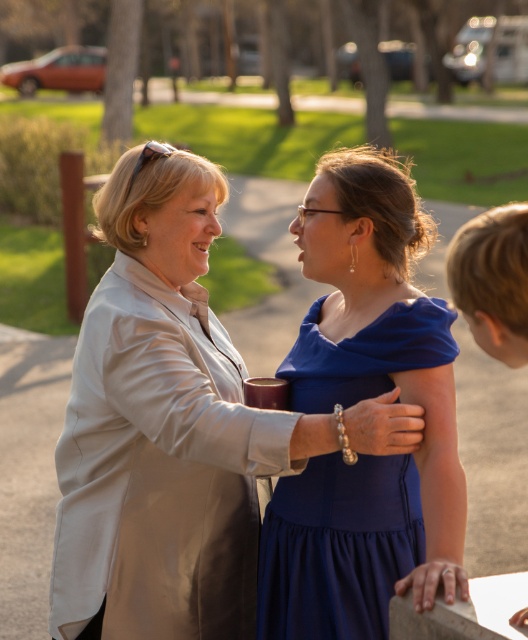
Question: Does satin beige blazer at center appear over royal blue satin dress at center?

Choices:
 (A) no
 (B) yes

Answer: (B)

Question: Which of the following is the farthest from the observer?

Choices:
 (A) (149, 276)
 (B) (325, 365)

Answer: (A)

Question: Can you confirm if satin beige blazer at center is bigger than royal blue satin dress at center?

Choices:
 (A) yes
 (B) no

Answer: (A)

Question: Does satin beige blazer at center appear over royal blue satin dress at center?

Choices:
 (A) no
 (B) yes

Answer: (B)

Question: Which point is closer to the camera?

Choices:
 (A) royal blue satin dress at center
 (B) satin beige blazer at center

Answer: (B)